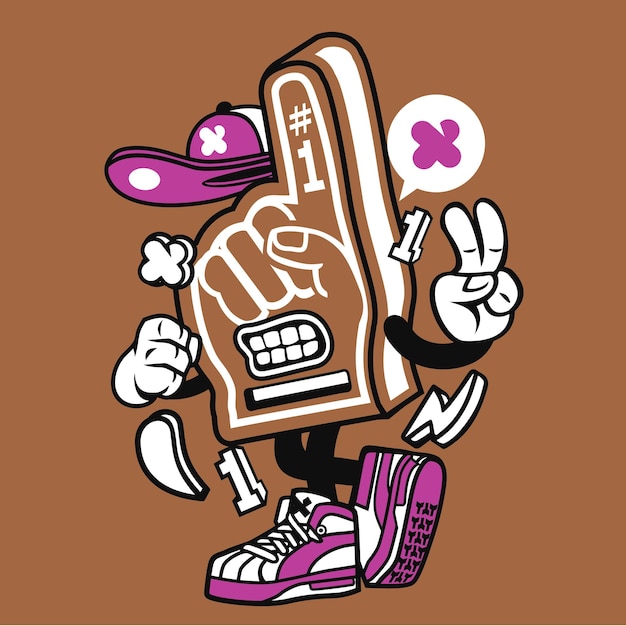
Locate an element on the screen. lace is located at coordinates (297, 528).